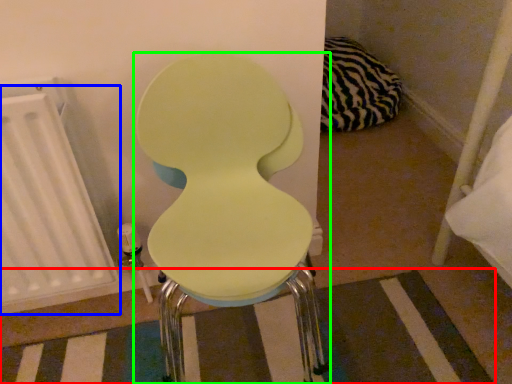
Question: Considering the real-world distances, which object is farthest from strip (highlighted by a red box)? radiator (highlighted by a blue box) or toilet (highlighted by a green box)?

Choices:
 (A) radiator
 (B) toilet

Answer: (B)